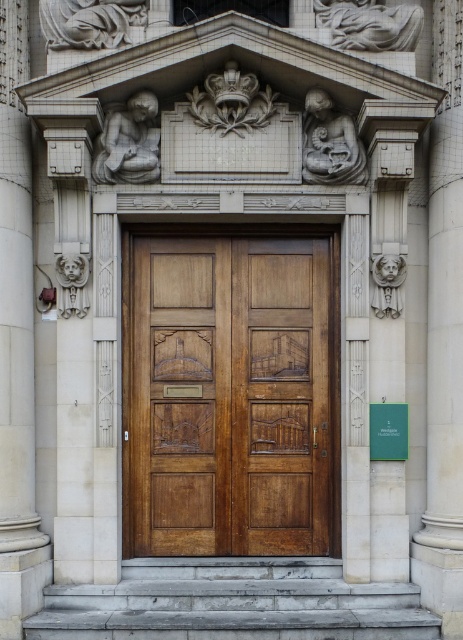
Question: Among these points, which one is farthest from the camera?

Choices:
 (A) (262, 419)
 (B) (168, 552)

Answer: (A)

Question: Among these points, which one is nearest to the camera?

Choices:
 (A) (281, 515)
 (B) (156, 552)
 (C) (231, 600)

Answer: (C)

Question: Is polished wood door at center positioned in front of gray stone stairs at lower center?

Choices:
 (A) no
 (B) yes

Answer: (A)

Question: Is polished wood door at center further to camera compared to wooden carved door at center?

Choices:
 (A) yes
 (B) no

Answer: (B)

Question: Observing the image, what is the correct spatial positioning of polished wood door at center in reference to wooden carved door at center?

Choices:
 (A) above
 (B) below

Answer: (A)

Question: Which of the following is the closest to the observer?

Choices:
 (A) (414, 589)
 (B) (231, 266)

Answer: (A)